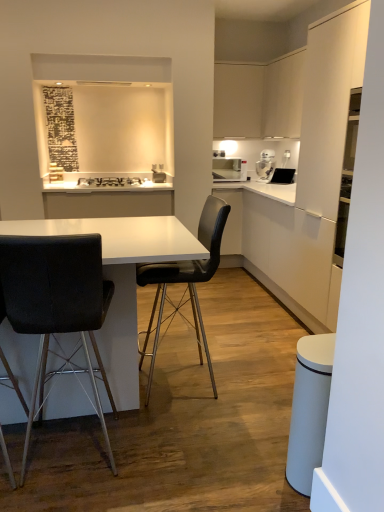
Find the location of a particular element. vacant space that's between black leather chair at center, arranged as the first chair when viewed from the right, and black leather chair at left, acting as the 2th chair starting from the right is located at coordinates (163, 423).